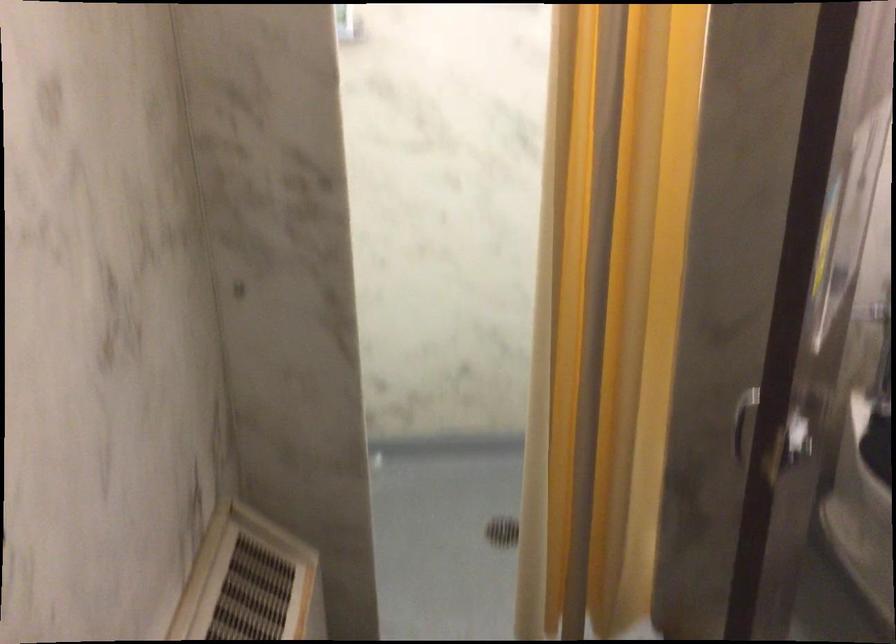
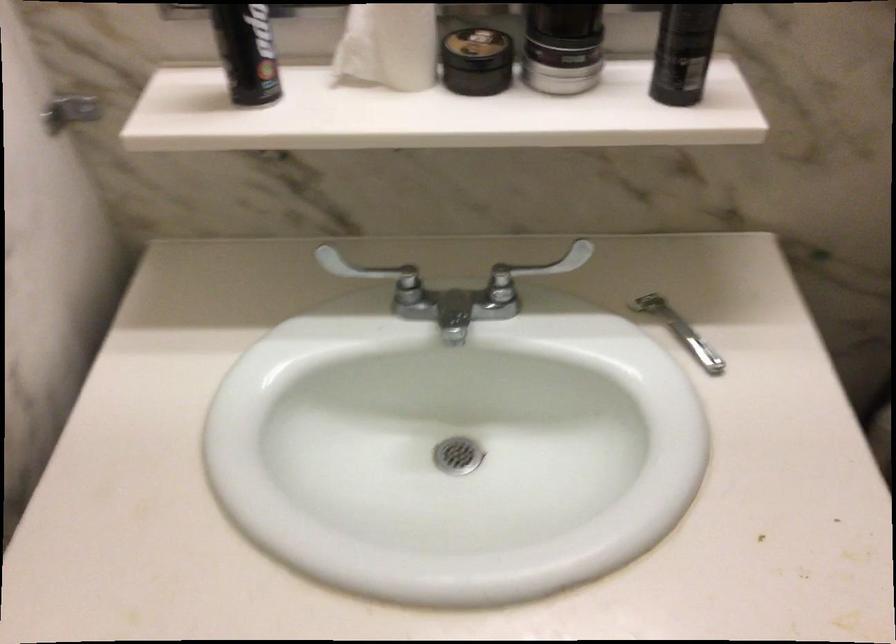
Based on the continuous images, in which direction is the camera rotating?

The rotation direction of the camera is right-down.